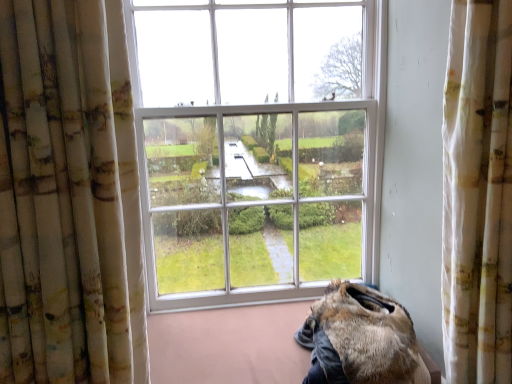
Question: Based on their sizes in the image, would you say white textured curtain at right, marked as the second curtain in a left-to-right arrangement, is bigger or smaller than fuzzy brown fur at lower right?

Choices:
 (A) small
 (B) big

Answer: (B)

Question: Looking at their shapes, would you say white textured curtain at right, acting as the 1th curtain starting from the right, is wider or thinner than fuzzy brown fur at lower right?

Choices:
 (A) thin
 (B) wide

Answer: (A)

Question: Which of these objects is positioned closest to the white floral fabric curtain at left, which is counted as the first curtain, starting from the left?

Choices:
 (A) white textured curtain at right, marked as the second curtain in a left-to-right arrangement
 (B) fuzzy brown fur at lower right

Answer: (B)

Question: Which of these objects is positioned closest to the white floral fabric curtain at left, which is counted as the first curtain, starting from the left?

Choices:
 (A) fuzzy brown fur at lower right
 (B) white textured curtain at right, marked as the second curtain in a left-to-right arrangement

Answer: (A)